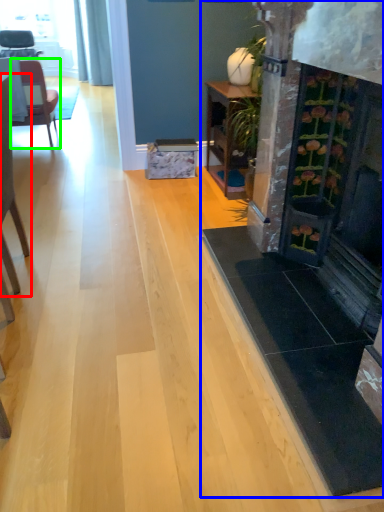
Question: Estimate the real-world distances between objects in this image. Which object is closer to chair (highlighted by a red box), fireplace (highlighted by a blue box) or chair (highlighted by a green box)?

Choices:
 (A) fireplace
 (B) chair

Answer: (A)